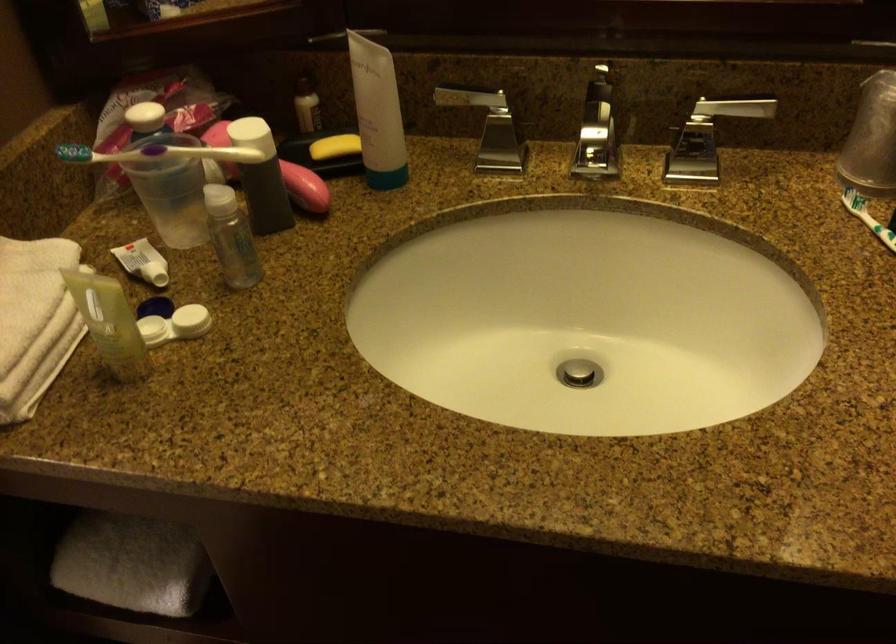
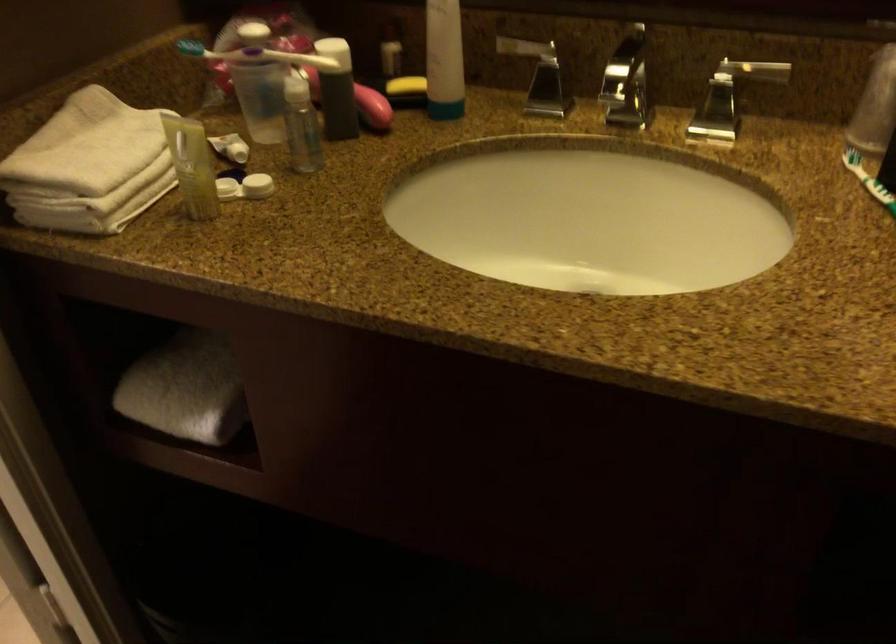
Locate, in the second image, the point that corresponds to (x=333, y=147) in the first image.

(406, 84)